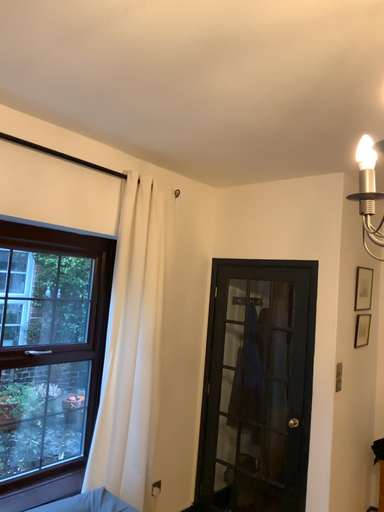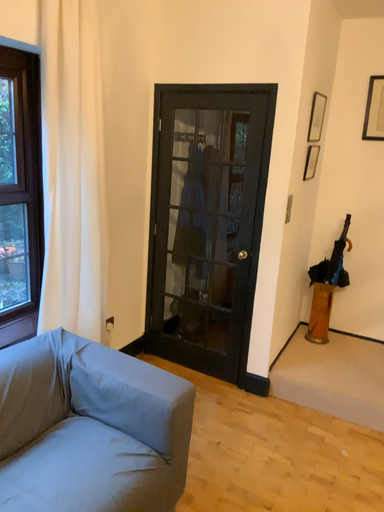
Question: How did the camera likely rotate when shooting the video?

Choices:
 (A) rotated left
 (B) rotated right

Answer: (B)